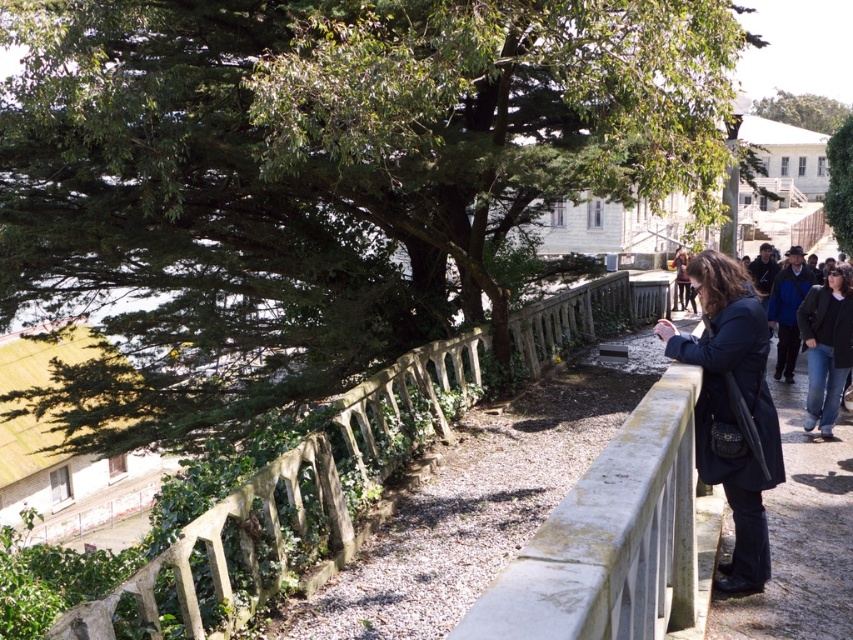
You are standing at the point labeled point (349, 467) and want to walk towards the building in the background. Is the point labeled point (848, 116) blocking your path?

Point (349, 467) is in front of point (848, 116), so the path towards the building is not blocked by point (848, 116).

You are a photographer positioned on the stone pathway. You want to capture a photo that includes both the stone textured fence at center and the green leafy tree at upper center. Based on their positions, which object should you frame first to ensure both are in the shot?

The stone textured fence at center is to the left of the green leafy tree at upper center, so you should frame the stone textured fence at center first to ensure both are included in the shot.

You are a landscape architect planning to install a new bench between the green leafy tree at upper right and the green leafy tree at upper center. Given the distance between them is 173.37 feet, is this distance suitable for placing a standard bench that requires at least 10 feet of space?

The distance between the green leafy tree at upper right and the green leafy tree at upper center is 173.37 feet, which is more than enough to place a standard bench requiring at least 10 feet of space.